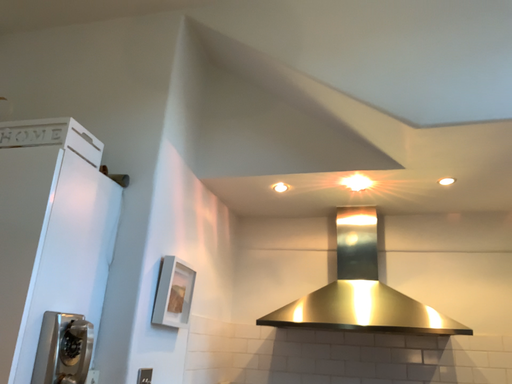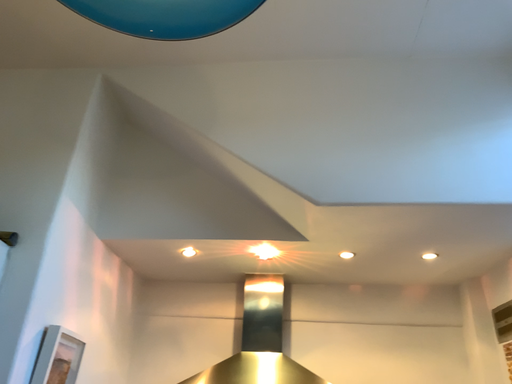
Question: Which way did the camera rotate in the video?

Choices:
 (A) rotated right
 (B) rotated left

Answer: (A)